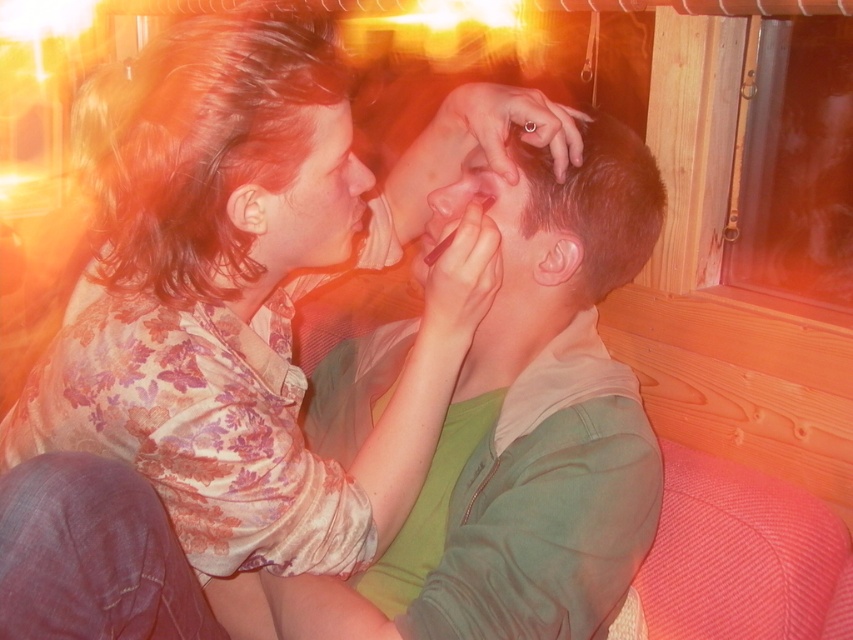
Question: Does floral silk blouse at center appear over matte skin at center?

Choices:
 (A) no
 (B) yes

Answer: (A)

Question: Which of these objects is positioned closest to the floral silk blouse at center?

Choices:
 (A) matte skin at center
 (B) matte floral shirt at upper left

Answer: (B)

Question: Which of these objects is positioned farthest from the matte floral shirt at upper left?

Choices:
 (A) floral silk blouse at center
 (B) matte skin at center

Answer: (B)

Question: Can you confirm if floral silk blouse at center is positioned above matte floral shirt at upper left?

Choices:
 (A) no
 (B) yes

Answer: (A)

Question: Is matte floral shirt at upper left to the right of matte skin at center from the viewer's perspective?

Choices:
 (A) yes
 (B) no

Answer: (B)

Question: Which point is closer to the camera?

Choices:
 (A) [x=289, y=381]
 (B) [x=519, y=170]
 (C) [x=305, y=202]

Answer: (C)